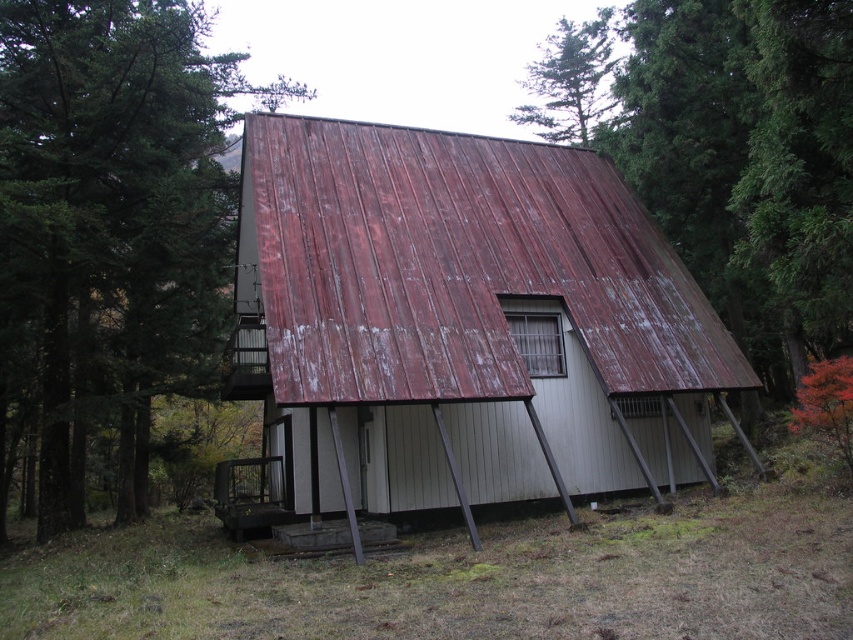
Question: Which object is the closest to the green leafy tree at upper center?

Choices:
 (A) green textured tree at upper center
 (B) green leafy tree at left
 (C) rusty metal barn at center

Answer: (A)

Question: Can you confirm if green textured tree at upper center is bigger than green leafy tree at upper center?

Choices:
 (A) no
 (B) yes

Answer: (B)

Question: Can you confirm if green leafy tree at left is smaller than green textured tree at upper center?

Choices:
 (A) no
 (B) yes

Answer: (A)

Question: Does green textured tree at upper center have a lesser width compared to green leafy tree at upper center?

Choices:
 (A) no
 (B) yes

Answer: (B)

Question: Estimate the real-world distances between objects in this image. Which object is farther from the green textured tree at upper center?

Choices:
 (A) green leafy tree at upper center
 (B) green leafy tree at left

Answer: (B)

Question: Which object is the farthest from the green leafy tree at left?

Choices:
 (A) green leafy tree at upper center
 (B) green textured tree at upper center

Answer: (A)